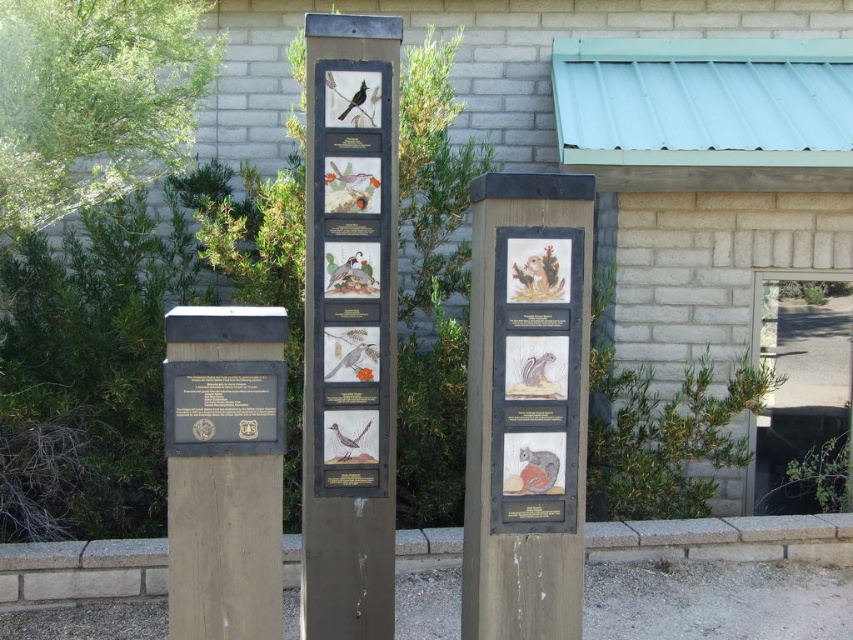
Who is more distant from viewer, (x=500, y=579) or (x=248, y=422)?

Point (x=500, y=579)

Can you confirm if matte gray signpost at center is positioned to the left of black polished stone plaque at center?

No, matte gray signpost at center is not to the left of black polished stone plaque at center.

Measure the distance between matte gray signpost at center and camera.

matte gray signpost at center and camera are 9.87 feet apart.

Where is `matte gray signpost at center`? This screenshot has width=853, height=640. matte gray signpost at center is located at coordinates (526, 404).

Is matte gray signpost at center wider than black polished wood sign at left?

Correct, the width of matte gray signpost at center exceeds that of black polished wood sign at left.

Is point (535, 349) less distant than point (207, 586)?

No, it is behind (207, 586).

Locate an element on the screen. The width and height of the screenshot is (853, 640). matte gray signpost at center is located at coordinates coord(526,404).

Does point (202, 563) lie in front of point (561, 275)?

Yes, it is in front of point (561, 275).

Who is lower down, black polished wood sign at left or matte wooden plaque at center?

black polished wood sign at left is lower down.

Does point (268, 378) come in front of point (515, 454)?

That is True.

Identify the location of black polished wood sign at left. (224, 472).